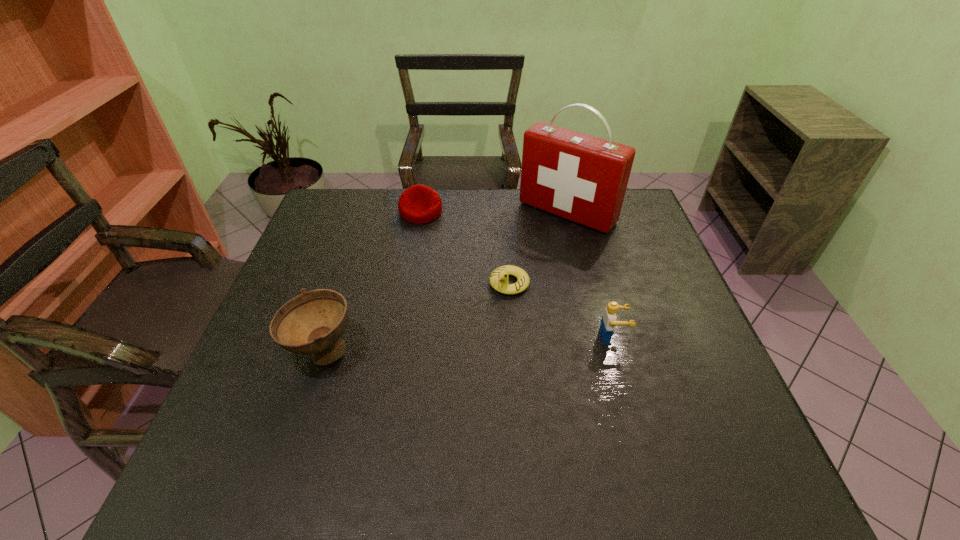
The image size is (960, 540). I want to click on object that is at the right edge, so click(582, 178).

Find the location of a particular element. This screenshot has height=540, width=960. object that is at the far right corner is located at coordinates (582, 178).

Locate an element on the screen. vacant space at the far edge of the desktop is located at coordinates (567, 226).

Identify the location of vacant space at the near edge of the desktop. (601, 433).

Find the location of a particular element. vacant region at the left edge is located at coordinates (290, 365).

Find the location of a particular element. free space at the right edge is located at coordinates (679, 338).

In the image, there is a desktop. At what (x,y) coordinates should I click in order to perform the action: click on vacant space at the far left corner. Please return your answer as a coordinate pair (x, y). Looking at the image, I should click on (364, 219).

Find the location of a particular element. The height and width of the screenshot is (540, 960). free region at the near left corner of the desktop is located at coordinates (267, 407).

Identify the location of free space at the near right corner of the desktop. The image size is (960, 540). (715, 399).

The image size is (960, 540). What are the coordinates of `free area in between the beanbag and the fourth shortest object` in the screenshot? It's located at (372, 282).